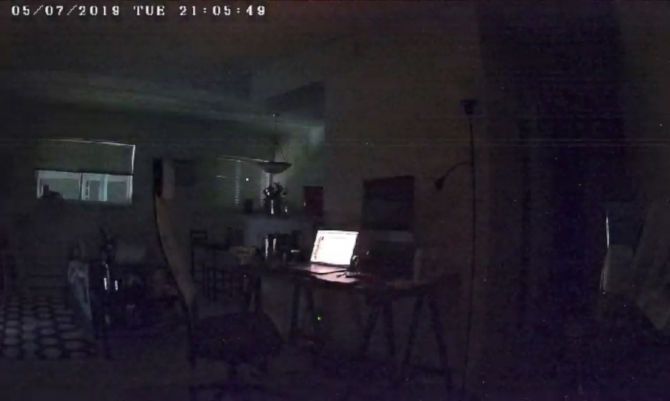
Where is `laptop`? laptop is located at coordinates (322, 240).